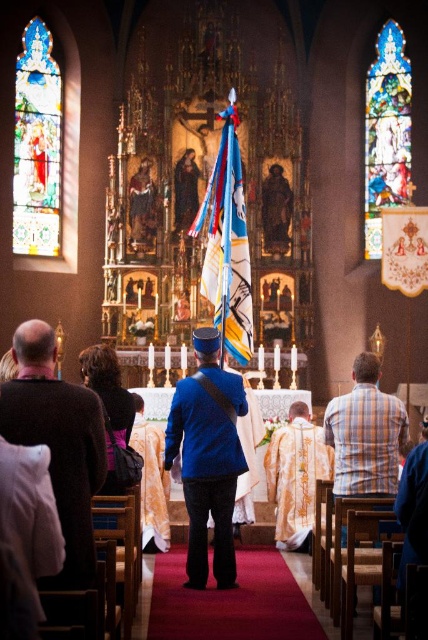
Is blue fabric uniform at center bigger than blue fabric flag at center?

No.

Is blue fabric uniform at center above blue fabric flag at center?

No, blue fabric uniform at center is not above blue fabric flag at center.

Which is in front, point (208, 396) or point (202, 282)?

Positioned in front is point (208, 396).

The image size is (428, 640). In order to click on blue fabric uniform at center in this screenshot , I will do `click(208, 458)`.

Which is below, dark brown sweater at left or blue fabric flag at center?

Positioned lower is dark brown sweater at left.

Does dark brown sweater at left have a larger size compared to blue fabric flag at center?

Indeed, dark brown sweater at left has a larger size compared to blue fabric flag at center.

The image size is (428, 640). What do you see at coordinates (58, 442) in the screenshot?
I see `dark brown sweater at left` at bounding box center [58, 442].

Locate an element on the screen. This screenshot has width=428, height=640. dark brown sweater at left is located at coordinates (58, 442).

Between dark brown sweater at left and plaid shirt at center, which one is positioned higher?

dark brown sweater at left

Between dark brown sweater at left and plaid shirt at center, which one has less height?

plaid shirt at center is shorter.

Is point (61, 572) farther from camera compared to point (356, 378)?

No.

The image size is (428, 640). Identify the location of dark brown sweater at left. (58, 442).